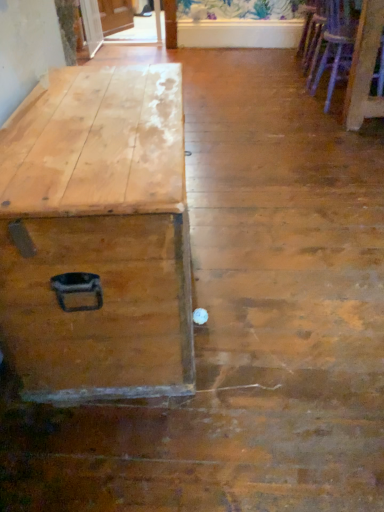
Question: Is natural wood trunk at left taller or shorter than wooden armchair at upper right, the 2th armchair when ordered from front to back?

Choices:
 (A) tall
 (B) short

Answer: (A)

Question: Do you think natural wood trunk at left is within wooden armchair at upper right, the 2th armchair when ordered from front to back, or outside of it?

Choices:
 (A) outside
 (B) inside

Answer: (A)

Question: Which object is the farthest from the natural wood trunk at left?

Choices:
 (A) wooden armchair at right, arranged as the 2th armchair when viewed from the top
 (B) wooden armchair at upper right, the 1th armchair from the back

Answer: (B)

Question: Estimate the real-world distances between objects in this image. Which object is closer to the wooden armchair at upper right, the 2th armchair when ordered from front to back?

Choices:
 (A) natural wood trunk at left
 (B) wooden armchair at right, positioned as the first armchair in bottom-to-top order

Answer: (B)